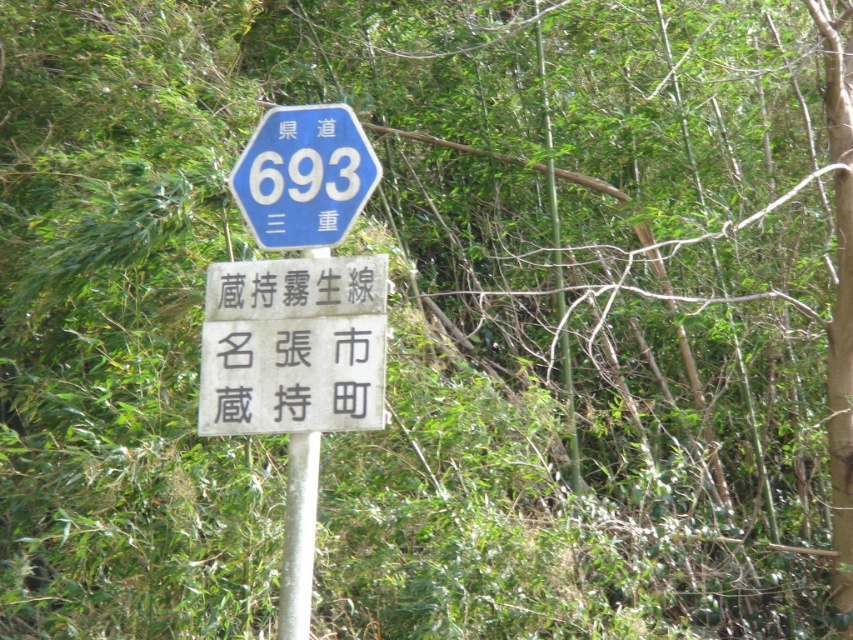
Question: Which object is farther from the camera taking this photo?

Choices:
 (A) white stone sign at center
 (B) white metallic pole at center
 (C) blue plastic hexagonal sign at upper center

Answer: (C)

Question: Does white stone sign at center have a larger size compared to white metallic pole at center?

Choices:
 (A) no
 (B) yes

Answer: (B)

Question: Is the position of white stone sign at center more distant than that of blue plastic hexagonal sign at upper center?

Choices:
 (A) no
 (B) yes

Answer: (A)

Question: Which point is farther from the camera taking this photo?

Choices:
 (A) (337, 113)
 (B) (225, 320)
 (C) (287, 545)

Answer: (A)

Question: Does white stone sign at center have a greater width compared to blue plastic hexagonal sign at upper center?

Choices:
 (A) no
 (B) yes

Answer: (B)

Question: Among these objects, which one is nearest to the camera?

Choices:
 (A) blue plastic hexagonal sign at upper center
 (B) white metallic pole at center

Answer: (B)